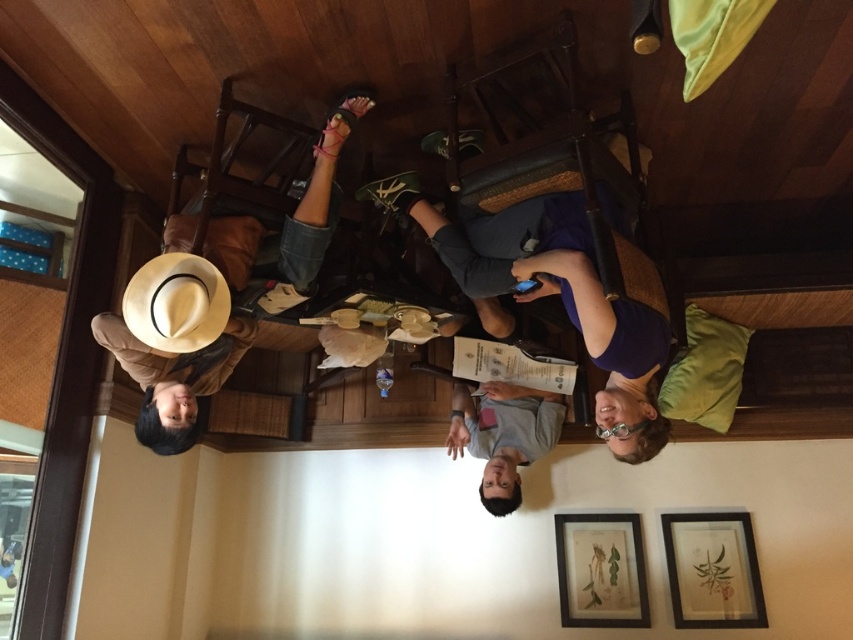
You are a customer in the upside down room. You see the purple fabric at center and the white felt cowboy hat at upper left. Which object is closer to the ceiling?

The purple fabric at center is closer to the ceiling because it is above the white felt cowboy hat at upper left.